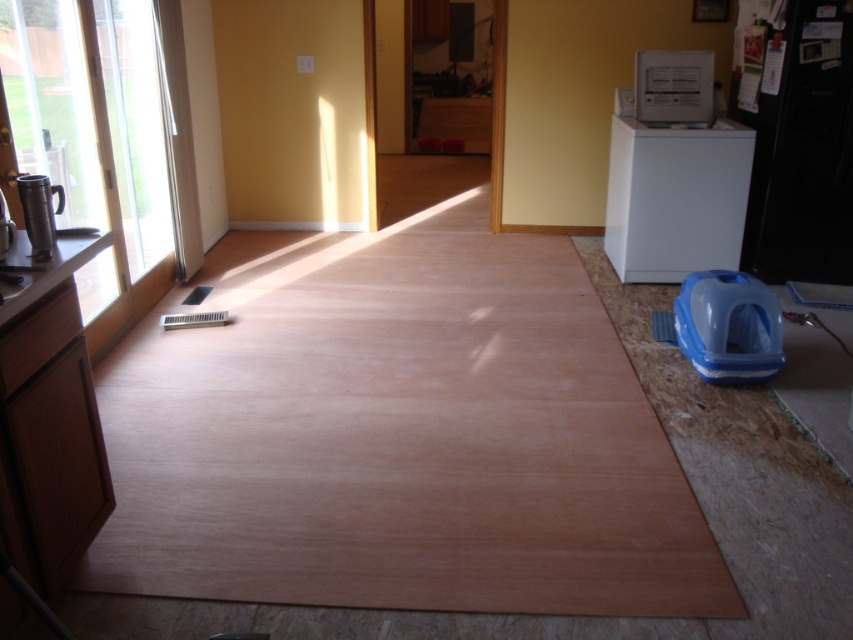
What do you see at coordinates (401, 444) in the screenshot? The height and width of the screenshot is (640, 853). I see `light brown wood at center` at bounding box center [401, 444].

Between point (357, 593) and point (654, 216), which one is positioned behind?

Point (654, 216)

The height and width of the screenshot is (640, 853). In order to click on light brown wood at center in this screenshot , I will do `click(401, 444)`.

Does light brown wood at center have a lesser height compared to metallic silver coffee pot at left?

In fact, light brown wood at center may be taller than metallic silver coffee pot at left.

Which is in front, point (285, 368) or point (13, 228)?

Positioned in front is point (13, 228).

The image size is (853, 640). Identify the location of light brown wood at center. (401, 444).

Between blue plastic dish washer at lower right and metallic silver thermos at left, which one has less height?

Standing shorter between the two is metallic silver thermos at left.

In the scene shown: Does blue plastic dish washer at lower right have a greater width compared to metallic silver thermos at left?

Yes, blue plastic dish washer at lower right is wider than metallic silver thermos at left.

The image size is (853, 640). I want to click on blue plastic dish washer at lower right, so click(728, 326).